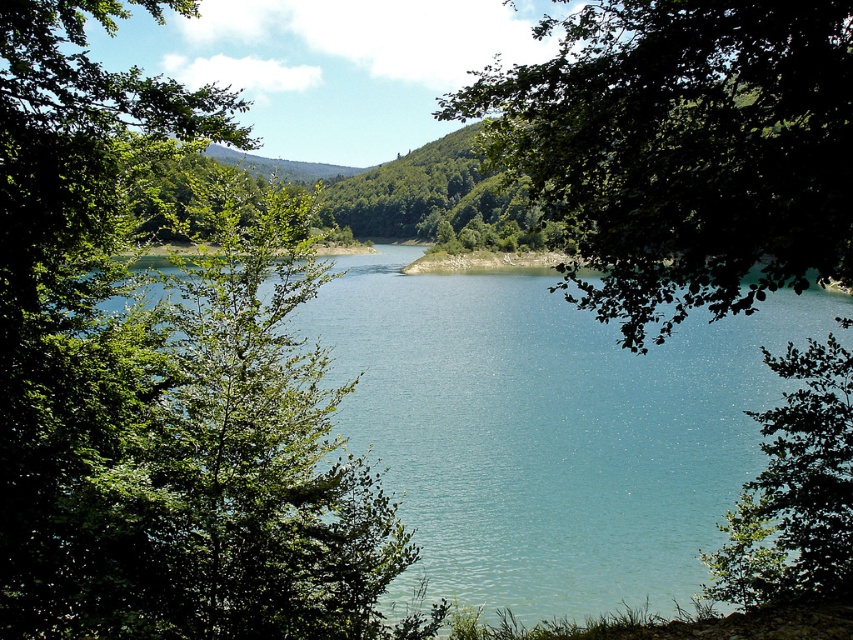
Which is more to the left, green leafy tree at left or green leafy tree at center?

green leafy tree at left

Does green leafy tree at left have a greater height compared to green leafy tree at center?

No, green leafy tree at left is not taller than green leafy tree at center.

Who is more forward, (242, 547) or (680, 291)?

Point (680, 291)

You are a GUI agent. You are given a task and a screenshot of the screen. Output one action in this format:
    pyautogui.click(x=<x>, y=<y>)
    Task: Click on the green leafy tree at left
    The width and height of the screenshot is (853, 640).
    Given the screenshot: What is the action you would take?
    pyautogui.click(x=163, y=372)

Can you confirm if clear water at center is positioned to the right of green leafy tree at center?

Incorrect, clear water at center is not on the right side of green leafy tree at center.

Is clear water at center to the left of green leafy tree at center from the viewer's perspective?

Correct, you'll find clear water at center to the left of green leafy tree at center.

Is point (672, 497) positioned after point (712, 129)?

Yes, it is.

Identify the location of clear water at center. The height and width of the screenshot is (640, 853). (548, 429).

Who is more distant from viewer, (119, 348) or (529, 620)?

The point (529, 620) is behind.

Does point (160, 390) come closer to viewer compared to point (407, 480)?

Yes, it is.

The height and width of the screenshot is (640, 853). Describe the element at coordinates (163, 372) in the screenshot. I see `green leafy tree at left` at that location.

I want to click on green leafy tree at left, so click(163, 372).